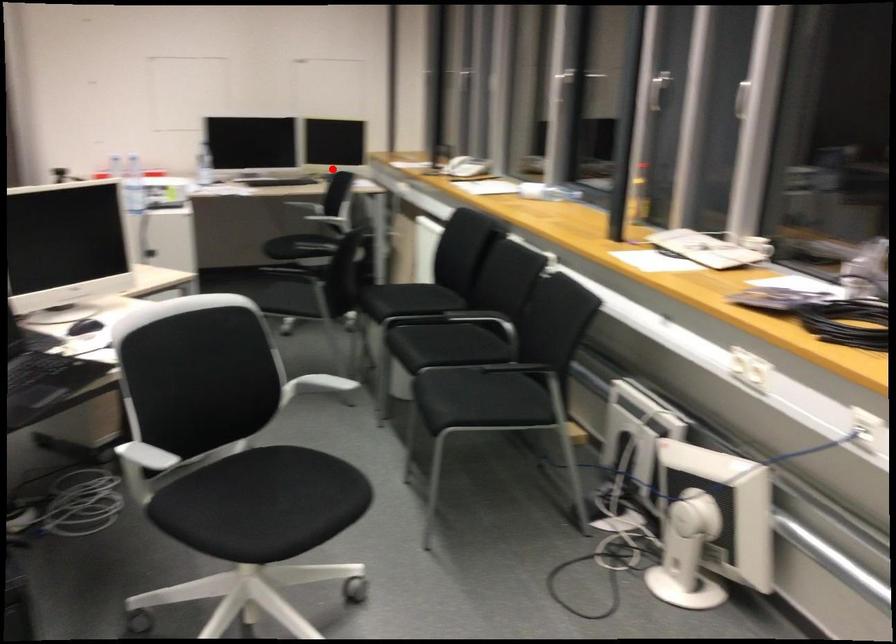
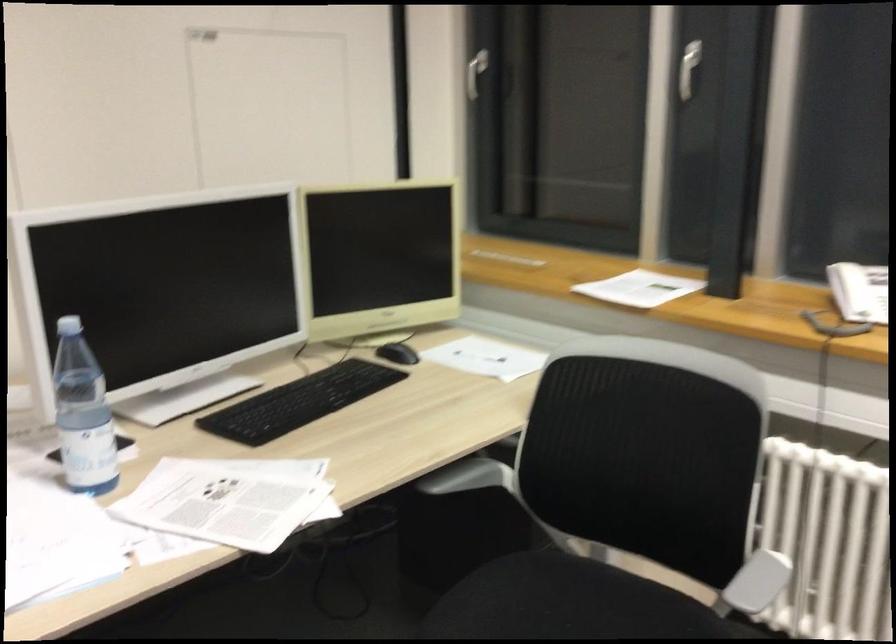
The point at the highlighted location is marked in the first image. Where is the corresponding point in the second image?

(398, 353)